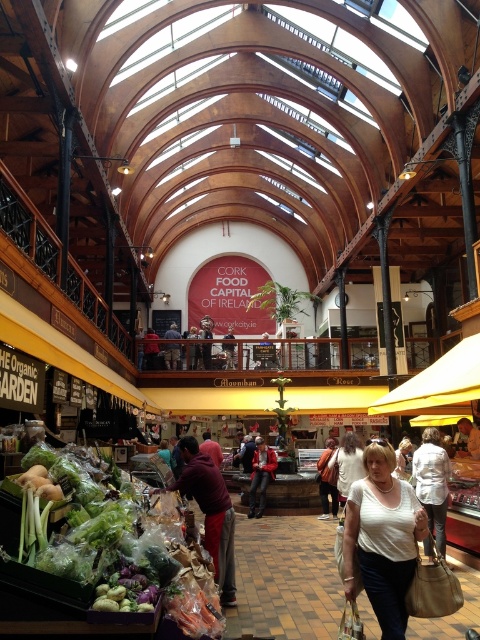
Between maroon sweater at center and red leather jacket at center, which one appears on the left side from the viewer's perspective?

From the viewer's perspective, maroon sweater at center appears more on the left side.

Does maroon sweater at center have a lesser width compared to red leather jacket at center?

No, maroon sweater at center is not thinner than red leather jacket at center.

At what (x,y) coordinates should I click in order to perform the action: click on maroon sweater at center. Please return your answer as a coordinate pair (x, y). The width and height of the screenshot is (480, 640). Looking at the image, I should click on (210, 513).

Image resolution: width=480 pixels, height=640 pixels. I want to click on green leafy vegetables at lower left, so click(104, 545).

Find the location of a particular element. green leafy vegetables at lower left is located at coordinates (104, 545).

Is maroon sweater at center smaller than white fabric shirt at center?

Correct, maroon sweater at center occupies less space than white fabric shirt at center.

Where is `maroon sweater at center`? This screenshot has width=480, height=640. maroon sweater at center is located at coordinates (210, 513).

This screenshot has height=640, width=480. Identify the location of maroon sweater at center. (210, 513).